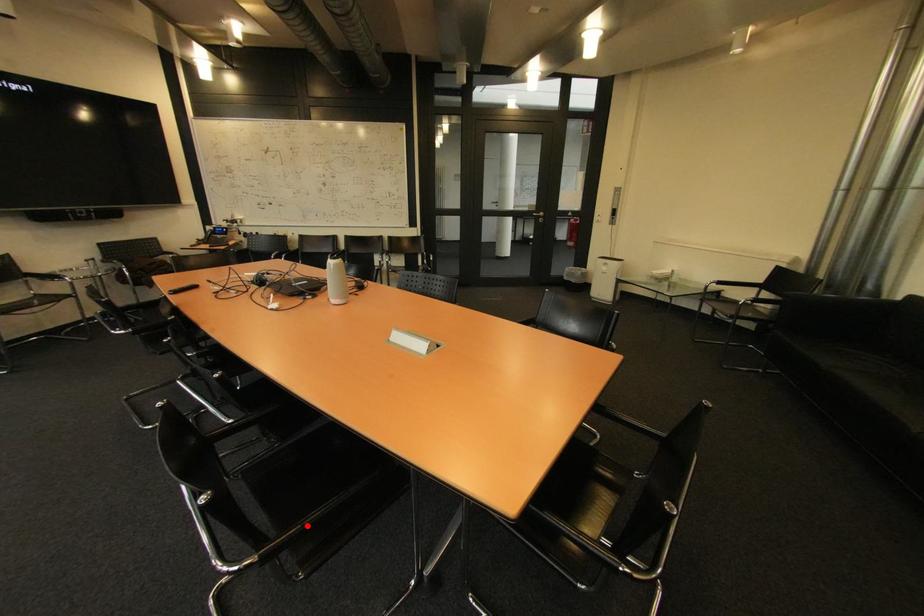
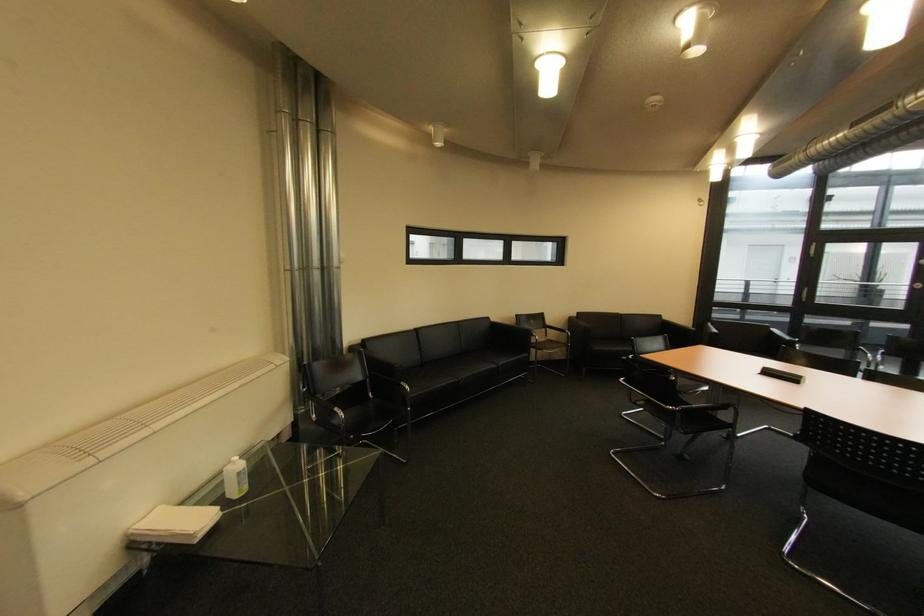
Question: I am providing you with two images of the same scene from different viewpoints. A red point is marked on the first image. Is the red point's position out of view in image 2?

Choices:
 (A) Yes
 (B) No

Answer: (A)